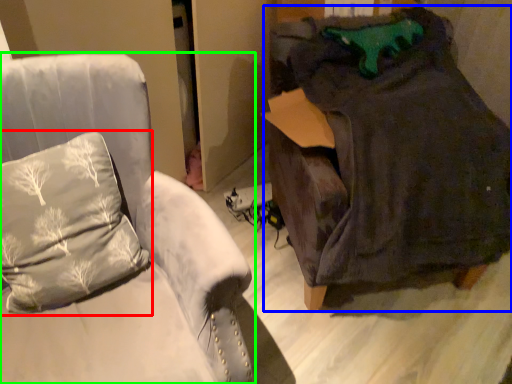
Question: Which object is positioned closest to pillow (highlighted by a red box)? Select from bean bag chair (highlighted by a blue box) and furniture (highlighted by a green box).

Choices:
 (A) bean bag chair
 (B) furniture

Answer: (B)